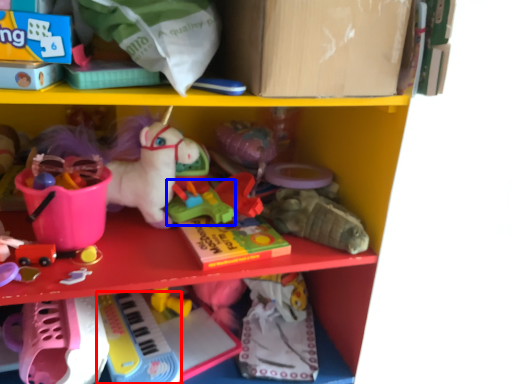
Question: Which of the following is the closest to the observer, toy (highlighted by a red box) or toy (highlighted by a blue box)?

Choices:
 (A) toy
 (B) toy

Answer: (A)